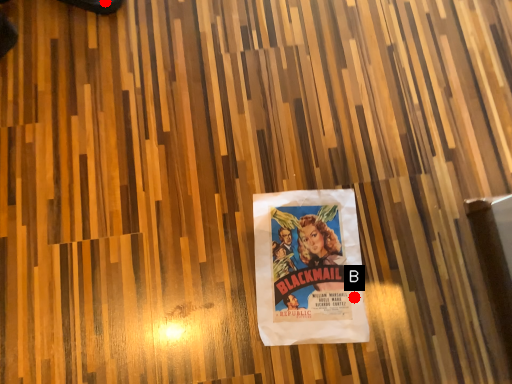
Question: Two points are circled on the image, labeled by A and B beside each circle. Among these points, which one is farthest from the camera?

Choices:
 (A) A is further
 (B) B is further

Answer: (A)